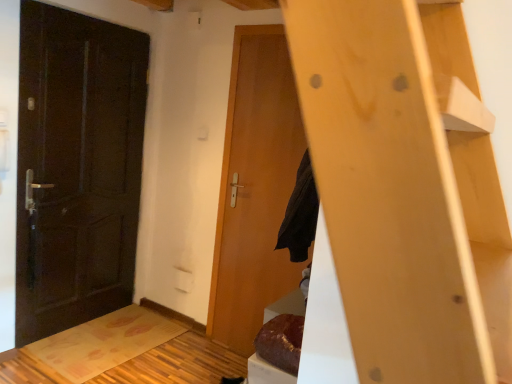
Locate an element on the screen. The width and height of the screenshot is (512, 384). free spot above matte dark brown door at left, which is the 1th door in left-to-right order (from a real-world perspective) is located at coordinates (77, 17).